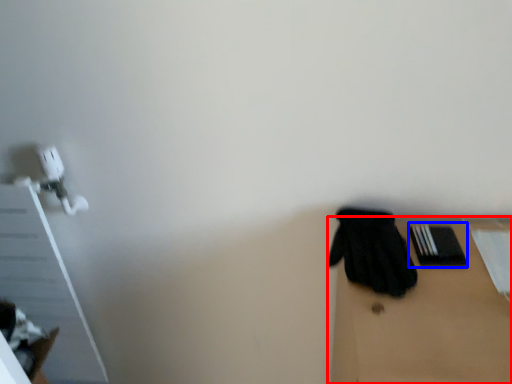
Question: Among these objects, which one is farthest to the camera, table (highlighted by a red box) or bin (highlighted by a blue box)?

Choices:
 (A) table
 (B) bin

Answer: (B)